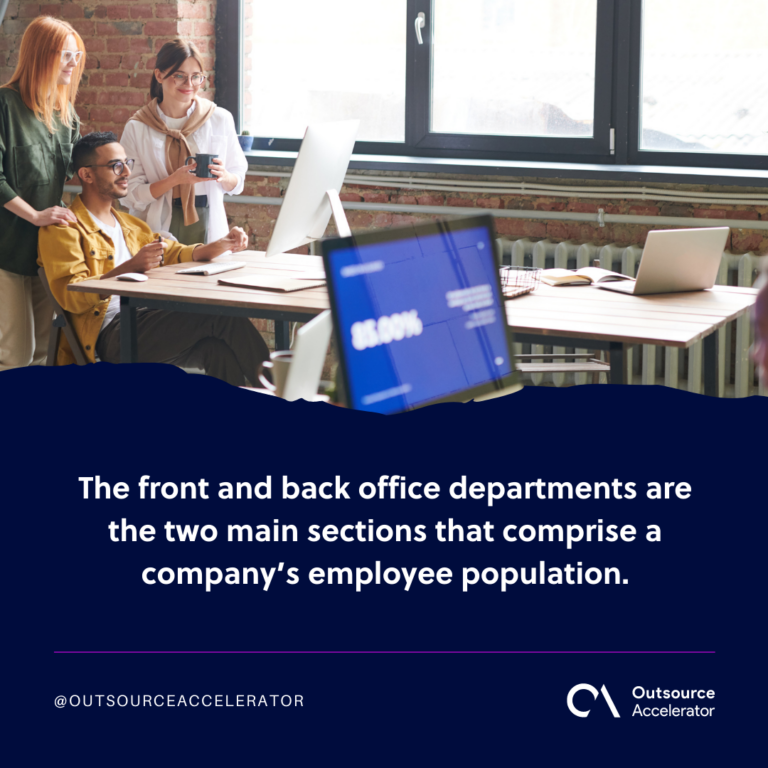
Find the location of a particular element. Image resolution: width=768 pixels, height=768 pixels. black window frame is located at coordinates (606, 51).